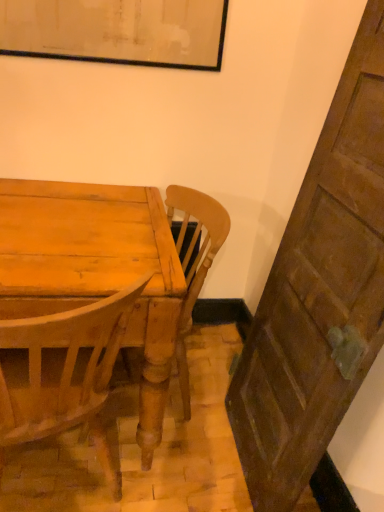
Where is `wooden chair at center`? This screenshot has height=512, width=384. wooden chair at center is located at coordinates (193, 261).

What do you see at coordinates (193, 261) in the screenshot?
I see `wooden chair at center` at bounding box center [193, 261].

At what (x,y) coordinates should I click in order to perform the action: click on wooden table top at center. Please return your answer as a coordinate pair (x, y). The height and width of the screenshot is (512, 384). Looking at the image, I should click on (95, 268).

Measure the distance between wooden table top at center and camera.

A distance of 35.42 inches exists between wooden table top at center and camera.

This screenshot has width=384, height=512. What do you see at coordinates (95, 268) in the screenshot? I see `wooden table top at center` at bounding box center [95, 268].

I want to click on wooden chair at center, so click(x=193, y=261).

Is wooden chair at center to the left of wooden table top at center from the viewer's perspective?

Incorrect, wooden chair at center is not on the left side of wooden table top at center.

Does wooden chair at center lie behind wooden table top at center?

Yes, wooden chair at center is further from the camera.

Considering the points (186, 276) and (158, 201), which point is behind, point (186, 276) or point (158, 201)?

Point (158, 201)

From the image's perspective, is wooden chair at center positioned above or below wooden table top at center?

From the image's perspective, wooden chair at center appears above wooden table top at center.

From a real-world perspective, who is located higher, wooden chair at center or wooden table top at center?

wooden chair at center, from a real-world perspective.

Which object is wider, wooden chair at center or wooden table top at center?

wooden table top at center is wider.

Considering the sizes of wooden chair at center and wooden table top at center in the image, is wooden chair at center taller or shorter than wooden table top at center?

In the image, wooden chair at center appears to be taller than wooden table top at center.

Who is bigger, wooden chair at center or wooden table top at center?

With larger size is wooden table top at center.

Is wooden table top at center located within wooden chair at center?

Yes, wooden table top at center is a part of wooden chair at center.

Is there a large distance between wooden chair at center and wooden table top at center?

wooden chair at center is near wooden table top at center, not far away.

In the scene shown: Is wooden chair at center turned away from wooden table top at center?

Yes, wooden chair at center is facing away from wooden table top at center.

How far apart are wooden chair at center and wooden table top at center?

wooden chair at center and wooden table top at center are 26.21 centimeters apart.

Image resolution: width=384 pixels, height=512 pixels. What are the coordinates of `table top that appears below the wooden chair at center (from a real-world perspective)` in the screenshot? It's located at (95, 268).

Looking at this image, considering the relative positions of wooden table top at center and wooden chair at center in the image provided, is wooden table top at center to the right of wooden chair at center from the viewer's perspective?

No.

Is wooden table top at center behind wooden chair at center?

No, it is in front of wooden chair at center.

Between point (78, 295) and point (211, 210), which one is positioned in front?

The point (78, 295) is closer.

From the image's perspective, who appears lower, wooden table top at center or wooden chair at center?

From the image's view, wooden table top at center is below.

From a real-world perspective, is wooden table top at center above or below wooden chair at center?

In terms of real-world spatial position, wooden table top at center is below wooden chair at center.

Considering the sizes of wooden table top at center and wooden chair at center in the image, is wooden table top at center wider or thinner than wooden chair at center?

Considering their sizes, wooden table top at center looks broader than wooden chair at center.

Between wooden table top at center and wooden chair at center, which one has less height?

wooden table top at center.

In the scene shown: Can you confirm if wooden table top at center is smaller than wooden chair at center?

No.

Is wooden table top at center not inside wooden chair at center?

Actually, wooden table top at center is at least partially inside wooden chair at center.

Is wooden table top at center with wooden chair at center?

wooden table top at center and wooden chair at center are not in contact.

Is wooden table top at center turned away from wooden chair at center?

Yes.

Identify the location of table top in front of the wooden chair at center. (95, 268).

The height and width of the screenshot is (512, 384). I want to click on table top below the wooden chair at center (from the image's perspective), so click(x=95, y=268).

Image resolution: width=384 pixels, height=512 pixels. I want to click on chair behind the wooden table top at center, so click(x=193, y=261).